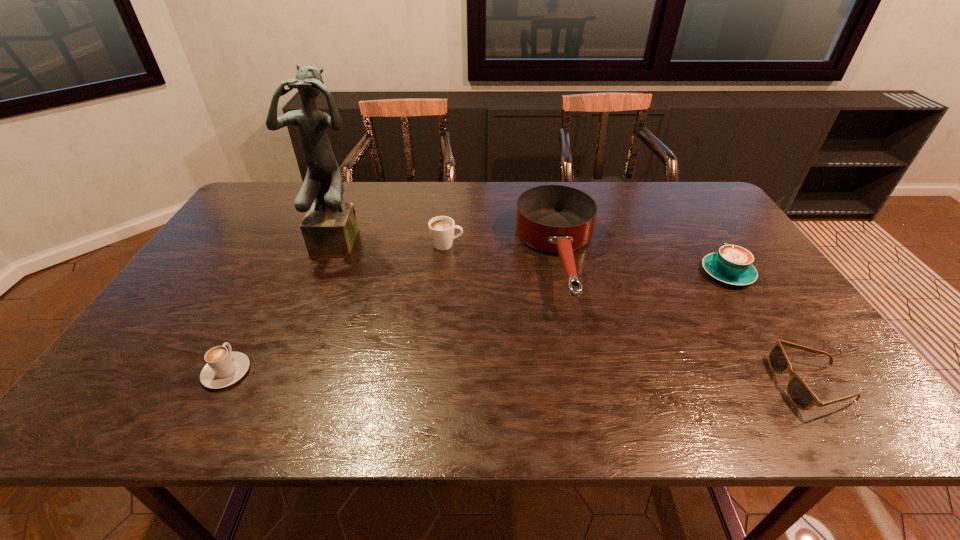
Find the location of `vacant position located with the handle on the side of the third object from left to right`. vacant position located with the handle on the side of the third object from left to right is located at coordinates [506, 245].

Identify the location of vacant space located 0.110m with the handle on the right side of the rightmost cappuccino. (703, 235).

In order to click on vacant region located with the handle on the right side of the rightmost cappuccino in this screenshot , I will do `click(692, 220)`.

At what (x,y) coordinates should I click in order to perform the action: click on free space located with the handle on the right side of the rightmost cappuccino. Please return your answer as a coordinate pair (x, y). Image resolution: width=960 pixels, height=540 pixels. Looking at the image, I should click on (674, 190).

You are a GUI agent. You are given a task and a screenshot of the screen. Output one action in this format:
    pyautogui.click(x=<x>, y=<y>)
    Task: Click on the vacant position located to the right of the nearest cappuccino
    Image resolution: width=960 pixels, height=540 pixels.
    Given the screenshot: What is the action you would take?
    pyautogui.click(x=258, y=311)

Find the location of a particular element. This screenshot has width=960, height=540. vacant space located 0.150m to the right of the nearest cappuccino is located at coordinates (260, 308).

Image resolution: width=960 pixels, height=540 pixels. I want to click on free space located to the right of the nearest cappuccino, so coord(260,308).

Where is `free location located 0.050m on the frames of the sunglasses`? free location located 0.050m on the frames of the sunglasses is located at coordinates (757, 384).

The image size is (960, 540). I want to click on vacant space situated on the frames of the sunglasses, so click(625, 384).

You are a GUI agent. You are given a task and a screenshot of the screen. Output one action in this format:
    pyautogui.click(x=<x>, y=<y>)
    Task: Click on the free space located 0.090m on the frames of the sunglasses
    The image size is (960, 540).
    Given the screenshot: What is the action you would take?
    pyautogui.click(x=739, y=384)